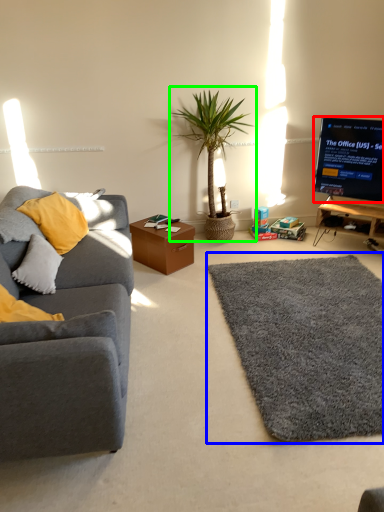
Question: Which object is positioned farthest from television (highlighted by a red box)? Select from mat (highlighted by a blue box) and houseplant (highlighted by a green box).

Choices:
 (A) mat
 (B) houseplant

Answer: (A)